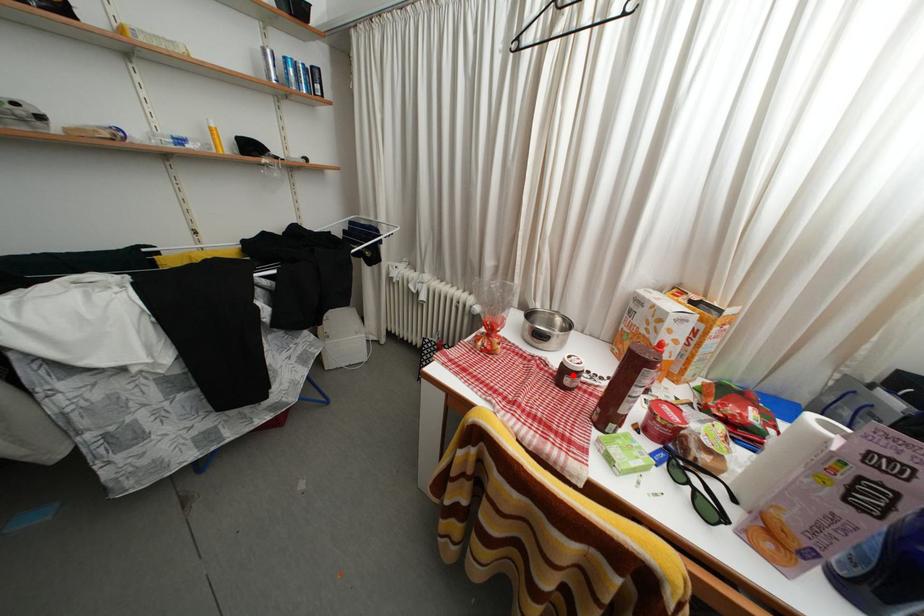
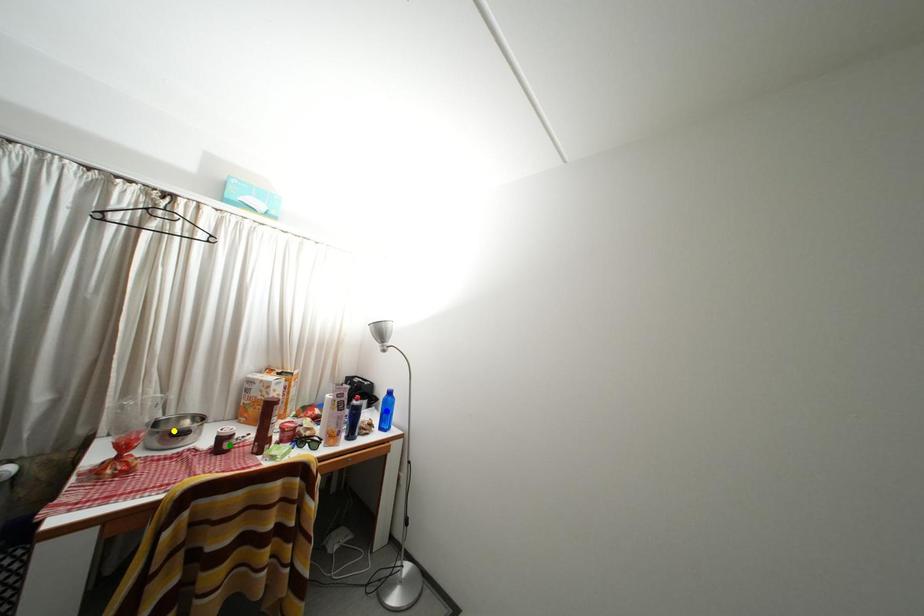
Question: I am providing you with two images of the same scene from different viewpoints. A red point is marked on the first image. You are given multiple points on the second image. Can you choose the point in image 2 that corresponds to the point in image 1?

Choices:
 (A) green point
 (B) blue point
 (C) yellow point

Answer: (A)